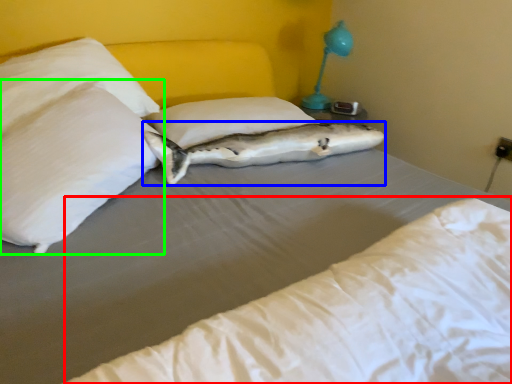
Question: Which object is the farthest from mattress (highlighted by a red box)? Choose among these: fish (highlighted by a blue box) or pillow (highlighted by a green box).

Choices:
 (A) fish
 (B) pillow

Answer: (A)